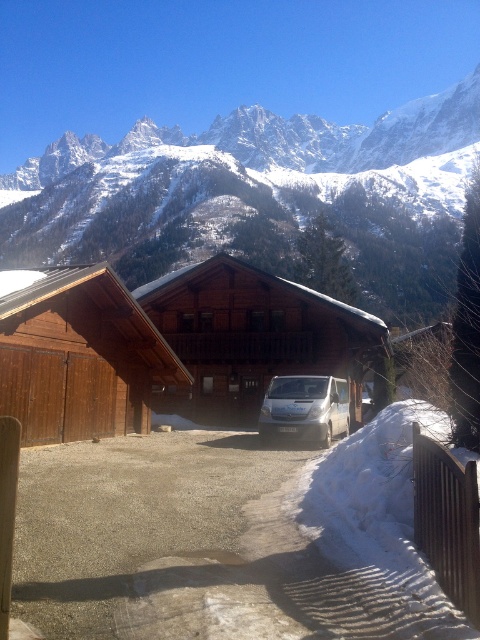
You are planning to take a photo of the snowy rock at upper center and the white metallic van at center. Since you want both objects in the frame, which one should you zoom in on more to ensure both are visible?

You should zoom in more on the snowy rock at upper center because it is larger than the white metallic van at center, so it will take up more space in the photo.

You are planning to take a photo of the wooden cabin at center and the brown wooden cabin at left. Which cabin should you focus on first if you want to capture both in a single frame without moving your camera?

You should focus on the wooden cabin at center first because it is positioned over the brown wooden cabin at left, meaning it is closer to the camera and would be the primary subject in the frame.

You are planning to take a photo of the wooden cabin at center and the white metallic van at center from the front. Which object will appear larger in the photo?

The wooden cabin at center will appear larger in the photo because it is taller than the white metallic van at center.